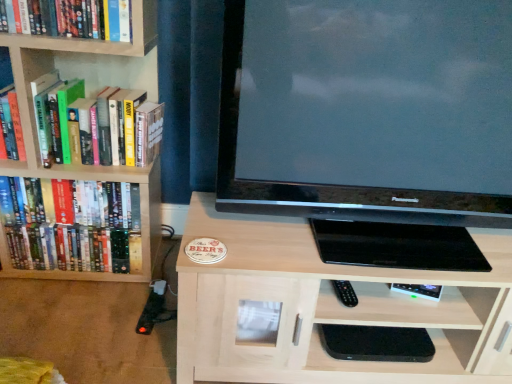
At what (x,y) coordinates should I click in order to perform the action: click on vacant region above light wood cabinet at center (from a real-world perspective). Please return your answer as a coordinate pair (x, y). Image resolution: width=512 pixels, height=384 pixels. Looking at the image, I should click on (346, 237).